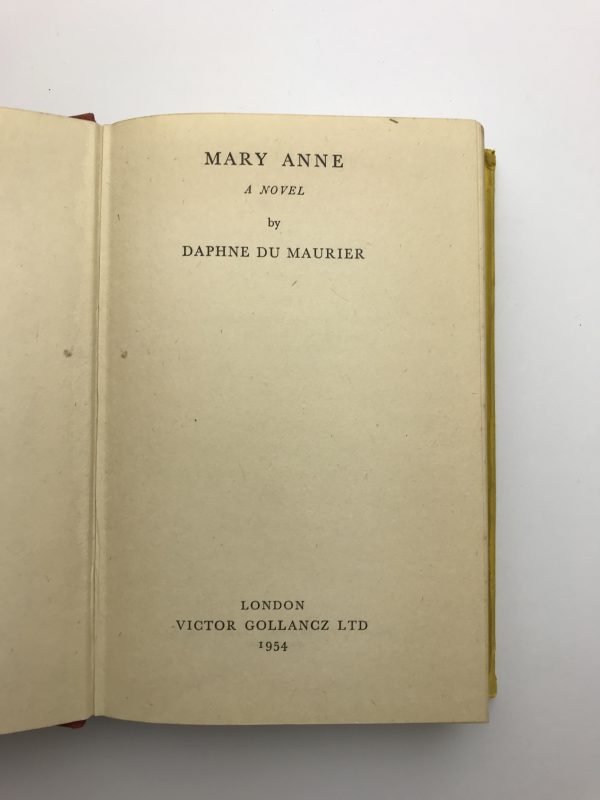
This screenshot has height=800, width=600. I want to click on book, so click(377, 385).